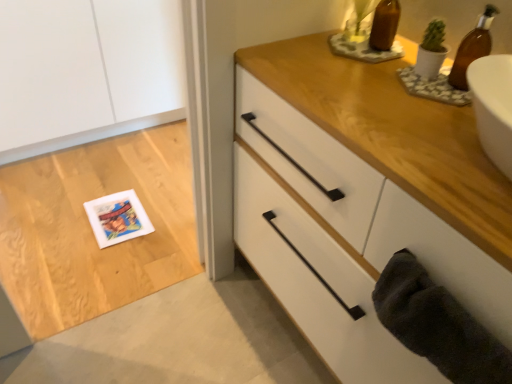
Where is `free space in front of brown glass bottle at upper right`? The width and height of the screenshot is (512, 384). free space in front of brown glass bottle at upper right is located at coordinates (372, 78).